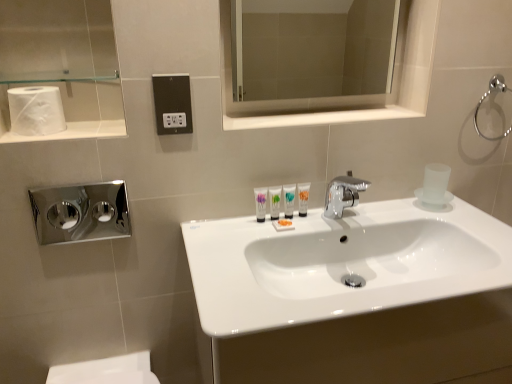
Locate an element on the screen. The height and width of the screenshot is (384, 512). vacant space positioned to the left of white glossy tube at center, the 1th toiletry viewed from the left is located at coordinates (225, 230).